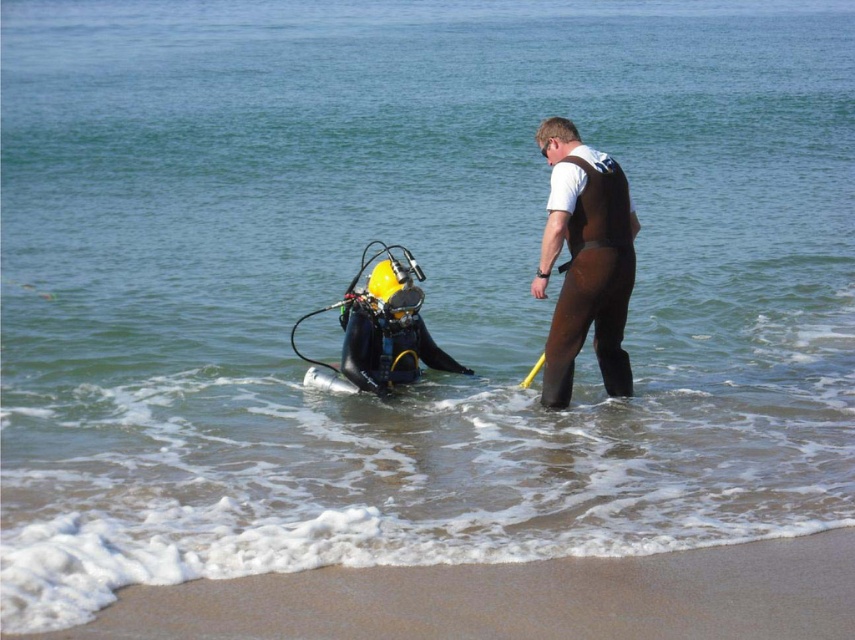
You are a lifeguard standing on the beach and need to reach the brown matte wetsuit at center quickly. Based on the scene, which direction should you move towards from the sandy beach at lower left?

The sandy beach at lower left is in front of the brown matte wetsuit at center, so you should move forward from the sandy beach at lower left to reach the brown matte wetsuit at center.

You are a photographer trying to capture a photo of the brown matte wetsuit at center and the sandy beach at lower left. Which object should you focus on first if you want to ensure both are in the frame without moving the camera?

You should focus on the brown matte wetsuit at center first because it is taller than the sandy beach at lower left, so it will be easier to position it within the frame while still including the sandy beach at lower left.